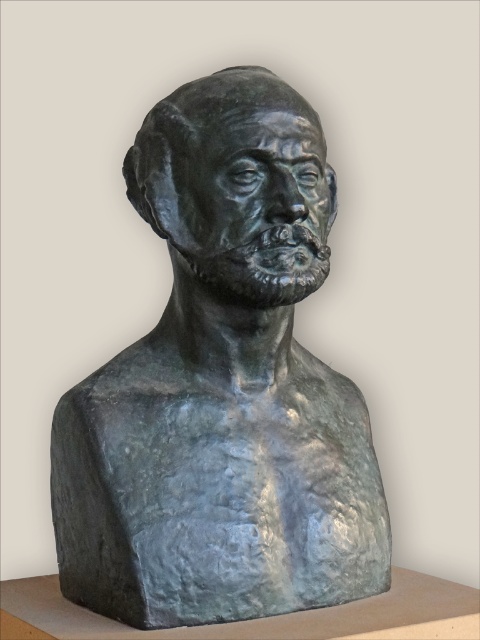
Does point (228, 108) come closer to viewer compared to point (175, 157)?

That is True.

Based on the photo, can you confirm if bronze bust at center is positioned above bronze sculpture at center?

No, bronze bust at center is not above bronze sculpture at center.

Does point (248, 84) come closer to viewer compared to point (313, 193)?

Yes, it is.

In order to click on bronze bust at center in this screenshot , I will do `click(223, 387)`.